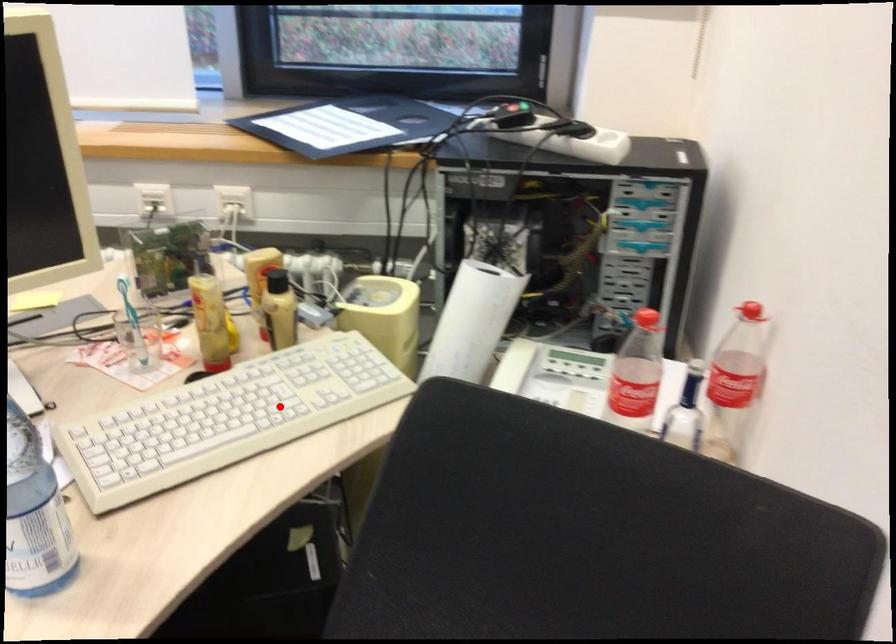
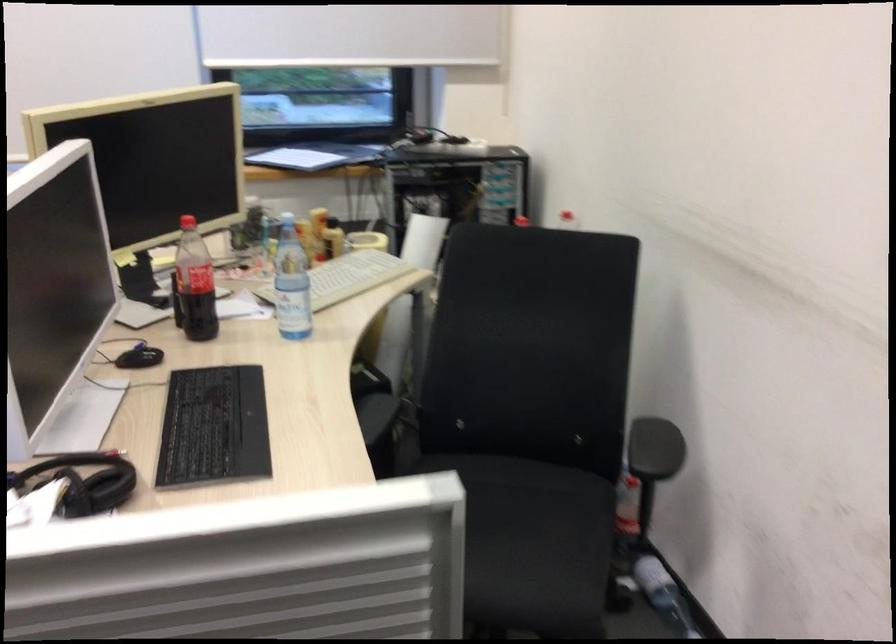
Where in the second image is the point corresponding to the highlighted location from the first image?

(347, 277)